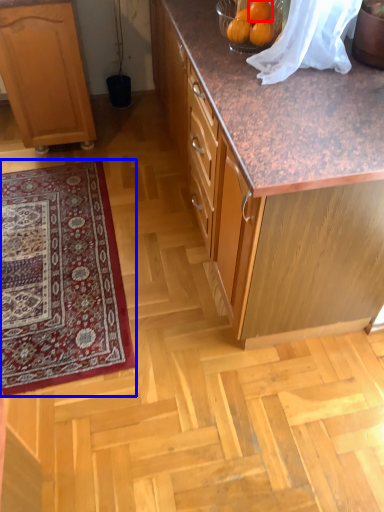
Question: Among these objects, which one is farthest to the camera, orange (highlighted by a red box) or mat (highlighted by a blue box)?

Choices:
 (A) orange
 (B) mat

Answer: (B)